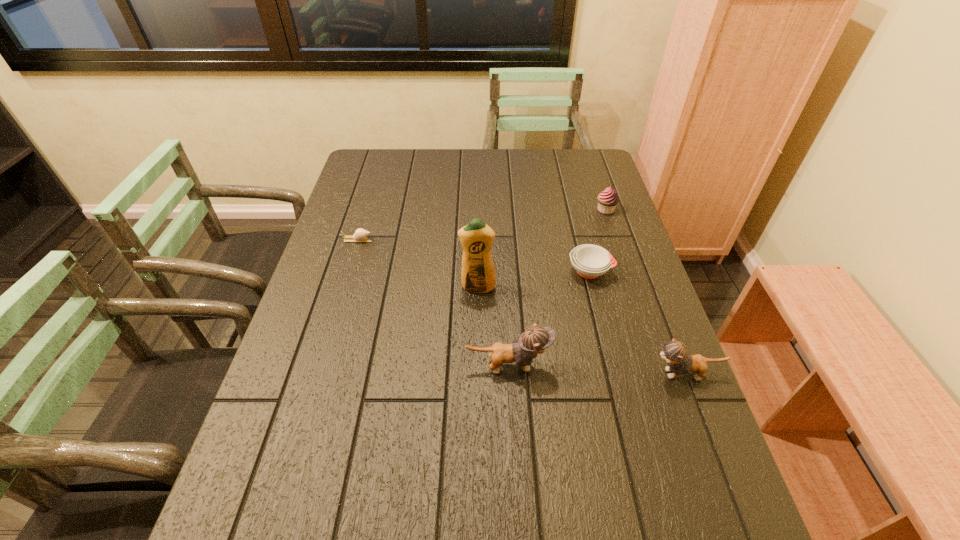
Image resolution: width=960 pixels, height=540 pixels. Identify the location of vacant area between the third tallest object and the fourth tallest object. (645, 292).

Identify the location of empty space that is in between the tallest object and the left kitten. (492, 327).

This screenshot has height=540, width=960. I want to click on empty space between the leftmost object and the detergent, so click(x=418, y=264).

Where is `unoccupied position between the third tallest object and the third object from right to left`? unoccupied position between the third tallest object and the third object from right to left is located at coordinates (637, 322).

Image resolution: width=960 pixels, height=540 pixels. What are the coordinates of `free point between the tallest object and the fifth nearest object` in the screenshot? It's located at (x=418, y=264).

I want to click on empty space between the fourth shortest object and the shortest object, so click(521, 307).

Find the location of a particular element. The image size is (960, 540). object that is the second nearest to the shortest object is located at coordinates click(536, 339).

You are a GUI agent. You are given a task and a screenshot of the screen. Output one action in this format:
    pyautogui.click(x=<x>, y=<y>)
    Task: Click on the object that stands as the fifth closest to the soup bowl
    
    Given the screenshot: What is the action you would take?
    pyautogui.click(x=360, y=235)

You are a GUI agent. You are given a task and a screenshot of the screen. Output one action in this format:
    pyautogui.click(x=<x>, y=<y>)
    Task: Click on the blank space that satisfies the following two spatial constraints: 1. on the front side of the cupcake; 2. on the front-facing side of the taller kitten
    The image size is (960, 540).
    Given the screenshot: What is the action you would take?
    pyautogui.click(x=658, y=366)